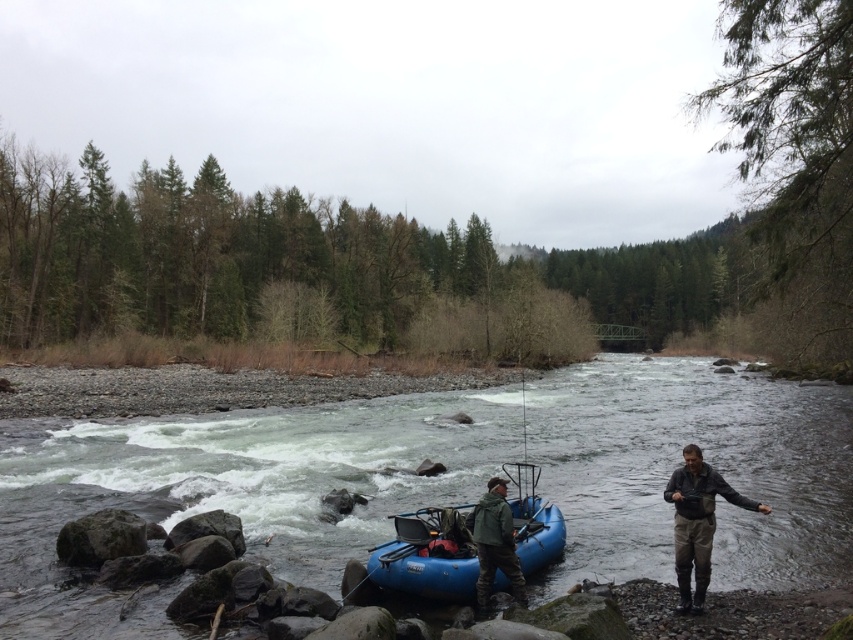
Question: Can you confirm if blue rubber boat at center is positioned to the left of green matte jacket at lower center?

Choices:
 (A) no
 (B) yes

Answer: (A)

Question: Among these objects, which one is farthest from the camera?

Choices:
 (A) green matte jacket at lower center
 (B) khaki cotton pants at lower right
 (C) blue rubber raft at lower center

Answer: (A)

Question: Does blue rubber boat at center come behind green matte jacket at lower center?

Choices:
 (A) yes
 (B) no

Answer: (A)

Question: Which of the following is the closest to the observer?

Choices:
 (A) khaki cotton pants at lower right
 (B) blue rubber boat at center

Answer: (A)

Question: Which point appears closest to the camera in this image?

Choices:
 (A) (502, 490)
 (B) (540, 552)
 (C) (701, 595)

Answer: (C)

Question: Can you confirm if blue rubber boat at center is positioned to the left of green matte jacket at lower center?

Choices:
 (A) yes
 (B) no

Answer: (B)